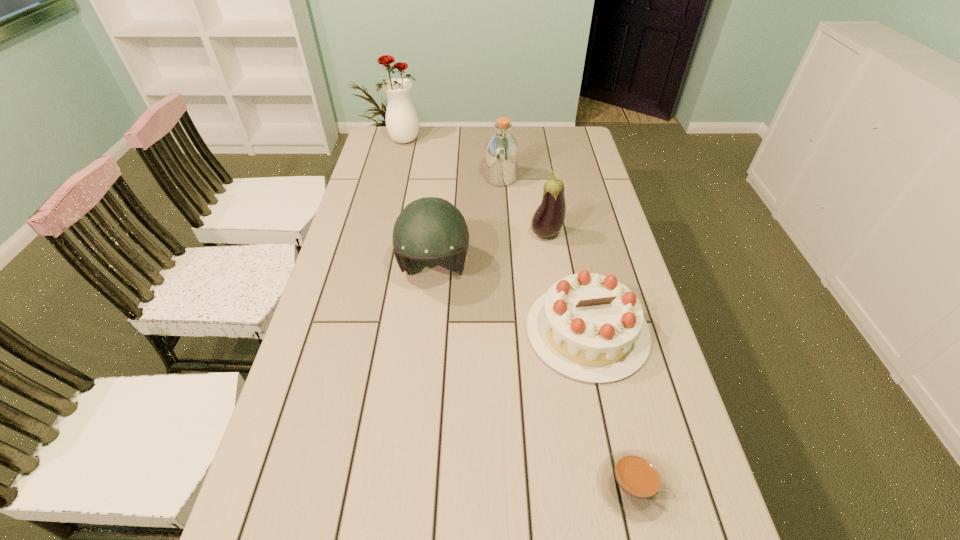
The height and width of the screenshot is (540, 960). Find the location of `vacant space at the left edge of the desktop`. vacant space at the left edge of the desktop is located at coordinates (356, 287).

At what (x,y) coordinates should I click in order to perform the action: click on vacant space at the right edge. Please return your answer as a coordinate pair (x, y). Image resolution: width=960 pixels, height=540 pixels. Looking at the image, I should click on (718, 534).

What are the coordinates of `free region at the far left corner` in the screenshot? It's located at (396, 144).

Identify the location of vacant space at the far right corner of the desktop. (570, 136).

Identify the location of vacant region between the fifth nearest object and the football helmet. (468, 223).

I want to click on vacant space that is in between the cappuccino and the tallest object, so click(x=517, y=313).

Locate an element on the screen. The width and height of the screenshot is (960, 540). free spot between the cappuccino and the birthday cake is located at coordinates (609, 409).

Find the location of `vacant region between the nearest object and the football helmet`. vacant region between the nearest object and the football helmet is located at coordinates 533,377.

The image size is (960, 540). In order to click on vacant area between the fifth nearest object and the birthday cake in this screenshot , I will do `click(544, 255)`.

Where is `free spot between the football helmet and the fifth nearest object`? The height and width of the screenshot is (540, 960). free spot between the football helmet and the fifth nearest object is located at coordinates (468, 223).